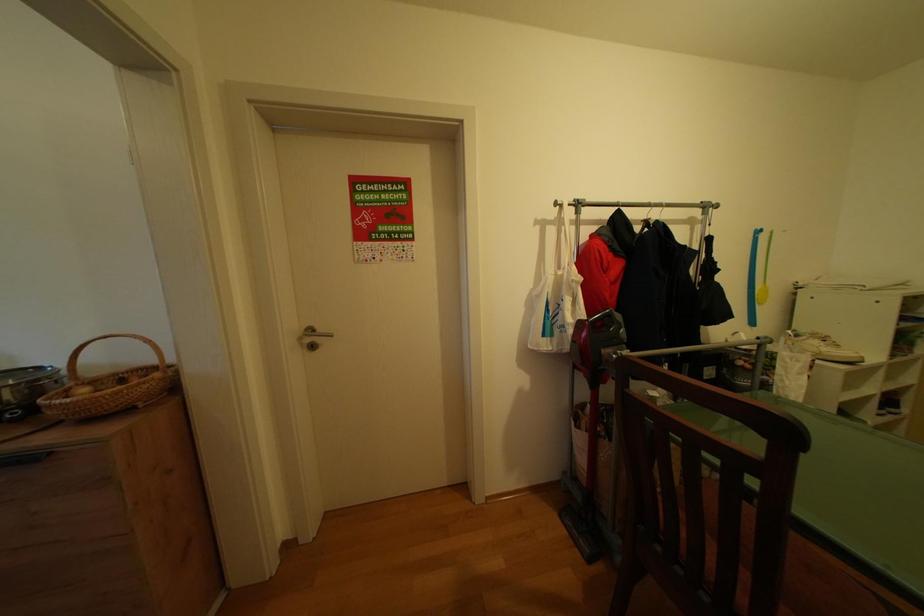
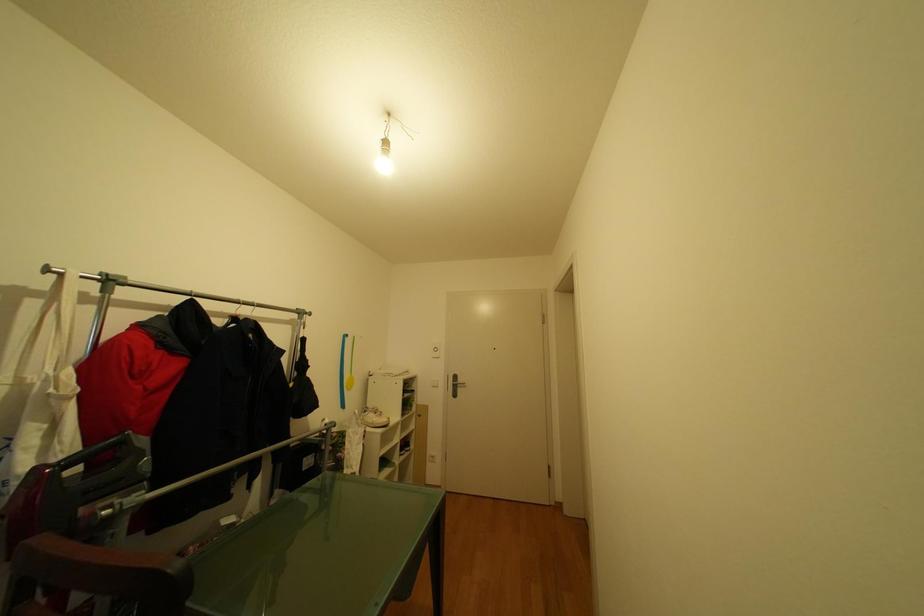
Question: The images are taken continuously from a first-person perspective. In which direction is your viewpoint rotating?

Choices:
 (A) Left
 (B) Right
 (C) Up
 (D) Down

Answer: (B)